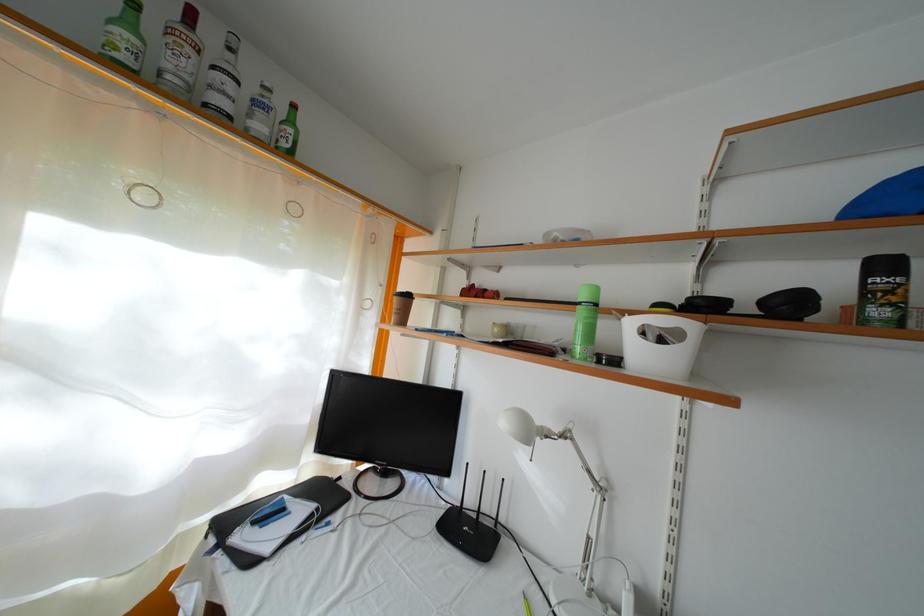
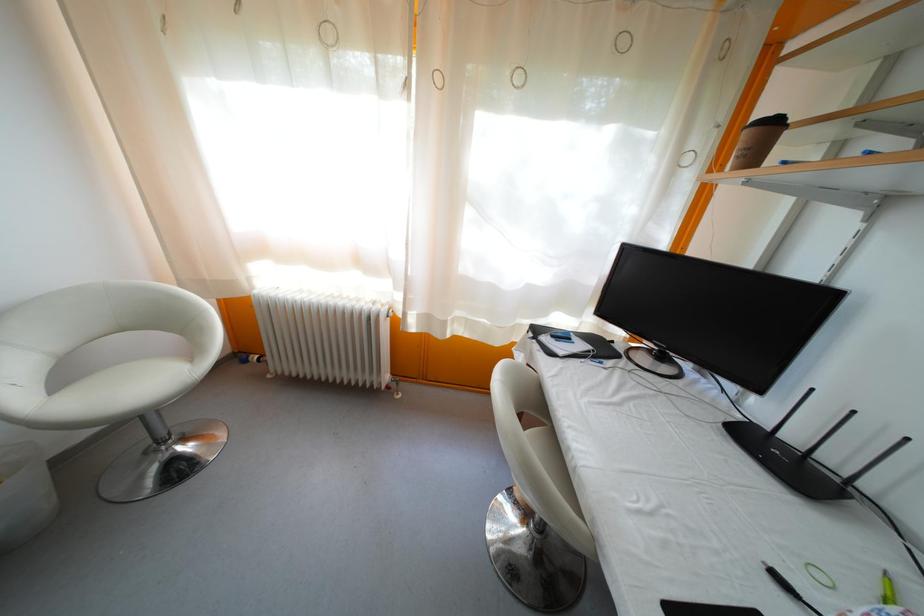
Looking at this image, first-person continuous shooting, in which direction is the camera rotating?

The camera's rotation is toward left-down.